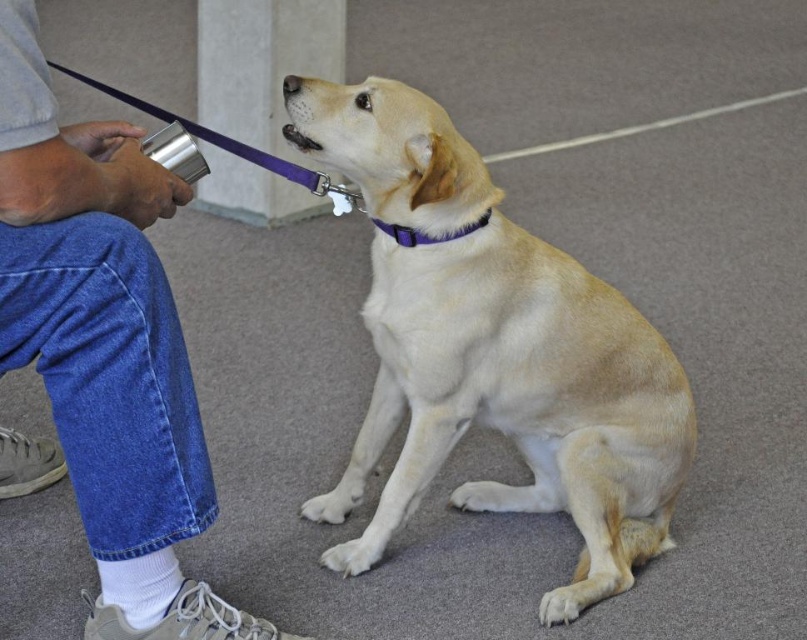
Does brushed metal cup at left appear on the left side of purple fabric collar at upper center?

Indeed, brushed metal cup at left is positioned on the left side of purple fabric collar at upper center.

Is point (169, 492) positioned behind point (399, 236)?

No, it is in front of (399, 236).

Find the location of a particular element. The width and height of the screenshot is (807, 640). brushed metal cup at left is located at coordinates (102, 353).

Does light brown fur at center have a larger size compared to purple fabric collar at upper center?

Indeed, light brown fur at center has a larger size compared to purple fabric collar at upper center.

Locate an element on the screen. light brown fur at center is located at coordinates (492, 349).

Does light brown fur at center have a greater height compared to brushed metal cup at left?

Yes.

Can you confirm if light brown fur at center is bigger than brushed metal cup at left?

Yes, light brown fur at center is bigger than brushed metal cup at left.

The height and width of the screenshot is (640, 807). What do you see at coordinates (492, 349) in the screenshot? I see `light brown fur at center` at bounding box center [492, 349].

Find the location of `light brown fur at center`. light brown fur at center is located at coordinates (492, 349).